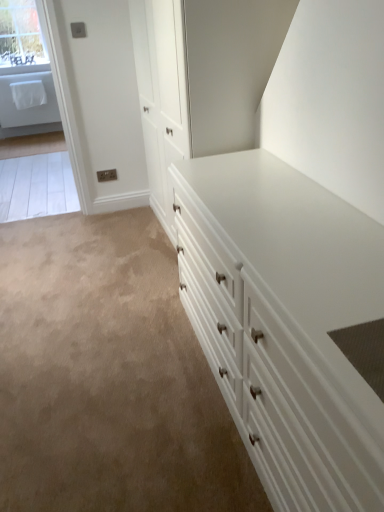
Question: Considering the relative sizes of clear glass window at upper left and white glossy chest of drawers at center in the image provided, is clear glass window at upper left smaller than white glossy chest of drawers at center?

Choices:
 (A) yes
 (B) no

Answer: (A)

Question: Could you tell me if clear glass window at upper left is facing white glossy chest of drawers at center?

Choices:
 (A) yes
 (B) no

Answer: (A)

Question: Is the position of clear glass window at upper left more distant than that of white glossy chest of drawers at center?

Choices:
 (A) yes
 (B) no

Answer: (A)

Question: Is clear glass window at upper left thinner than white glossy chest of drawers at center?

Choices:
 (A) no
 (B) yes

Answer: (B)

Question: From a real-world perspective, does clear glass window at upper left sit lower than white glossy chest of drawers at center?

Choices:
 (A) no
 (B) yes

Answer: (A)

Question: Is the position of clear glass window at upper left less distant than that of white glossy chest of drawers at center?

Choices:
 (A) yes
 (B) no

Answer: (B)

Question: Does white glossy chest of drawers at center have a smaller size compared to clear glass window at upper left?

Choices:
 (A) yes
 (B) no

Answer: (B)

Question: Considering the relative sizes of white glossy chest of drawers at center and clear glass window at upper left in the image provided, is white glossy chest of drawers at center thinner than clear glass window at upper left?

Choices:
 (A) no
 (B) yes

Answer: (A)

Question: Is white glossy chest of drawers at center behind clear glass window at upper left?

Choices:
 (A) no
 (B) yes

Answer: (A)

Question: Is white glossy chest of drawers at center wider than clear glass window at upper left?

Choices:
 (A) no
 (B) yes

Answer: (B)

Question: Is white glossy chest of drawers at center shorter than clear glass window at upper left?

Choices:
 (A) yes
 (B) no

Answer: (B)

Question: Is white glossy chest of drawers at center oriented away from clear glass window at upper left?

Choices:
 (A) yes
 (B) no

Answer: (B)

Question: In terms of height, does clear glass window at upper left look taller or shorter compared to white glossy chest of drawers at center?

Choices:
 (A) short
 (B) tall

Answer: (A)